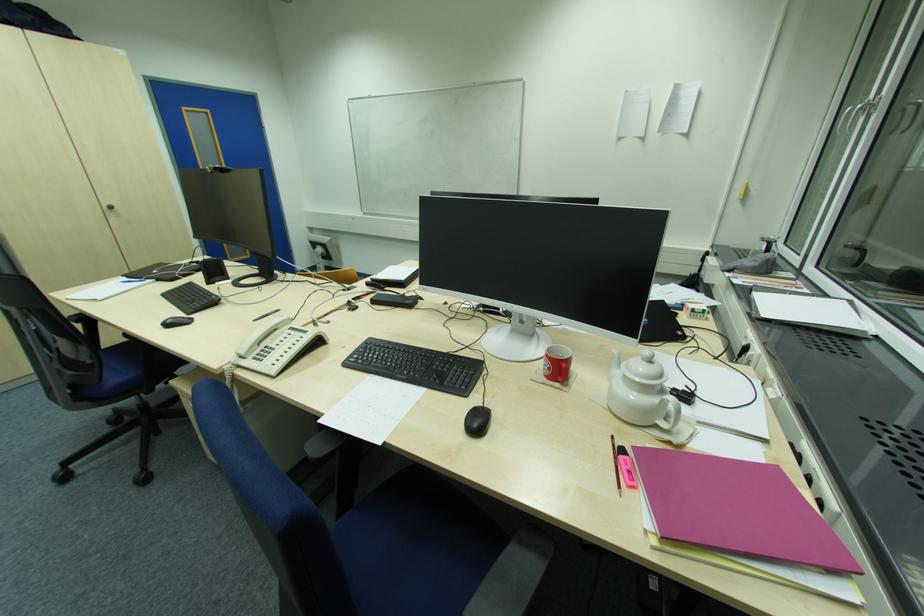
You are a GUI agent. You are given a task and a screenshot of the screen. Output one action in this format:
    pyautogui.click(x=<x>, y=<y>)
    Task: Click on the blue chair armrest
    
    Given the screenshot: What is the action you would take?
    pyautogui.click(x=214, y=400)